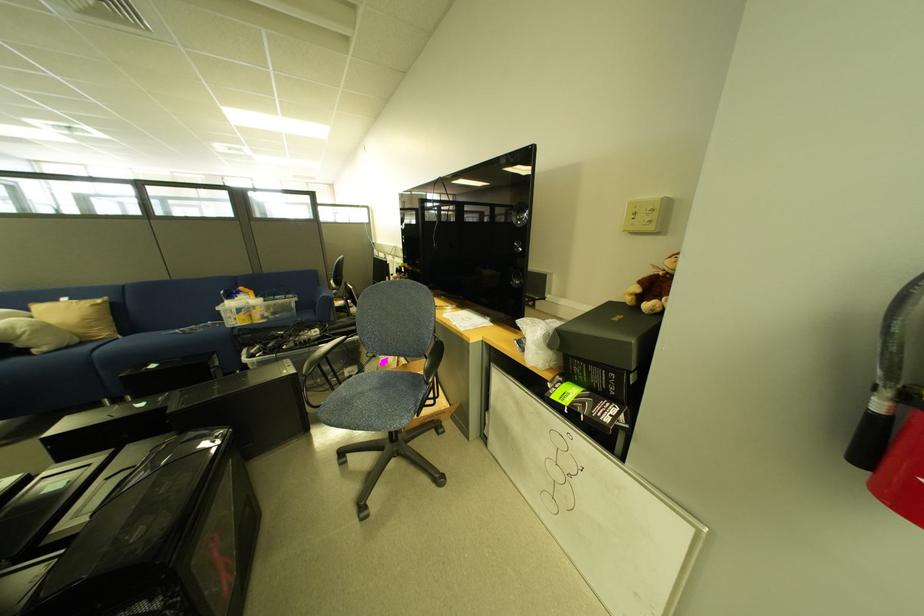
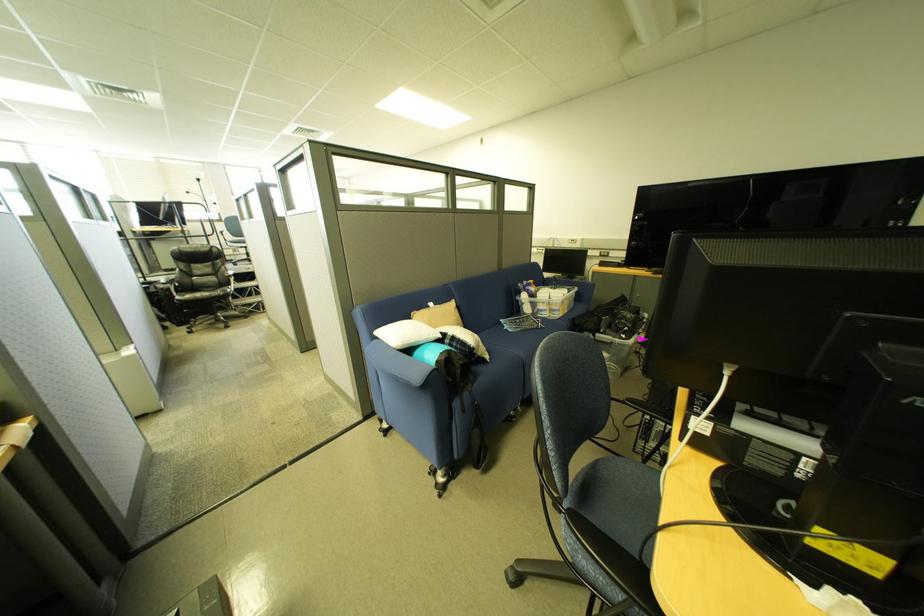
Question: Which direction would the cameraman need to move to produce the second image? Reply with the corresponding letter.

Choices:
 (A) Left
 (B) Right
 (C) Forward
 (D) Backward

Answer: (A)